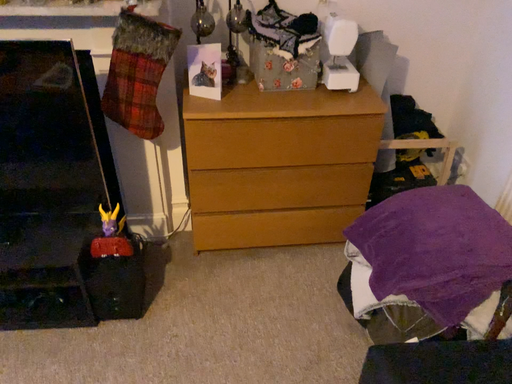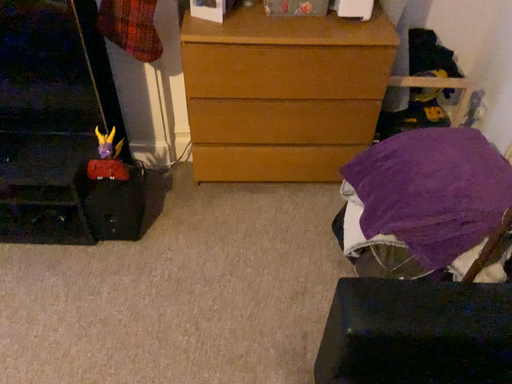
Question: Which way did the camera rotate in the video?

Choices:
 (A) rotated upward
 (B) rotated downward

Answer: (B)